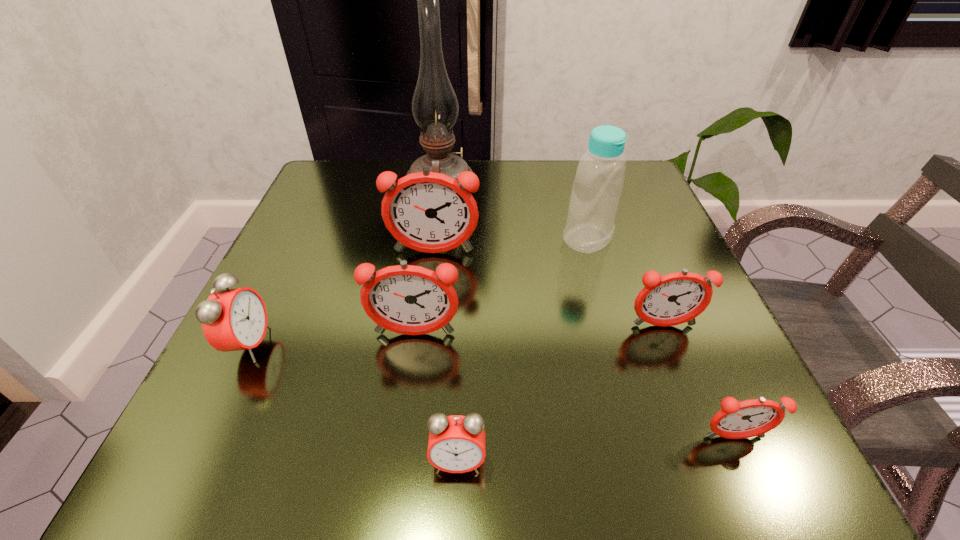
You are a GUI agent. You are given a task and a screenshot of the screen. Output one action in this format:
    pyautogui.click(x=<x>, y=<y>)
    Task: Click on the tallest object
    The image size is (960, 540).
    Given the screenshot: What is the action you would take?
    pyautogui.click(x=435, y=108)

I want to click on bronze oil lamp, so click(x=435, y=108).

This screenshot has width=960, height=540. In order to click on the second tallest object in this screenshot , I will do `click(599, 180)`.

The image size is (960, 540). Find the location of `bottle`. bottle is located at coordinates (599, 180).

Find the location of `the farthest alarm clock`. the farthest alarm clock is located at coordinates (430, 212).

The width and height of the screenshot is (960, 540). In order to click on the tallest alarm clock in this screenshot , I will do `click(430, 212)`.

I want to click on the second biggest reddish-pink alarm clock, so click(405, 299).

Find the location of a particular element. The height and width of the screenshot is (540, 960). the fifth shortest object is located at coordinates (405, 299).

This screenshot has height=540, width=960. I want to click on the second smallest reddish-pink alarm clock, so click(x=676, y=298).

You are a GUI agent. You are given a task and a screenshot of the screen. Output one action in this format:
    pyautogui.click(x=<x>, y=<y>)
    Task: Click on the leftmost alarm clock
    The width and height of the screenshot is (960, 540).
    Given the screenshot: What is the action you would take?
    pyautogui.click(x=233, y=319)